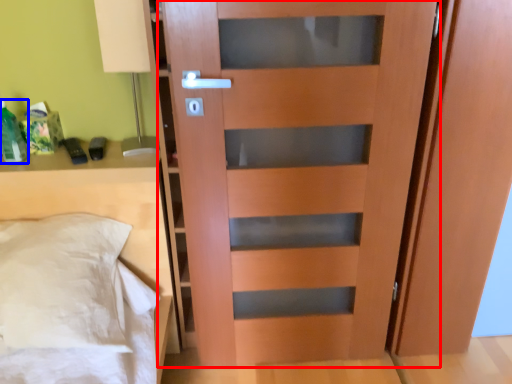
Question: Which object is further to the camera taking this photo, door (highlighted by a red box) or bottle (highlighted by a blue box)?

Choices:
 (A) door
 (B) bottle

Answer: (B)